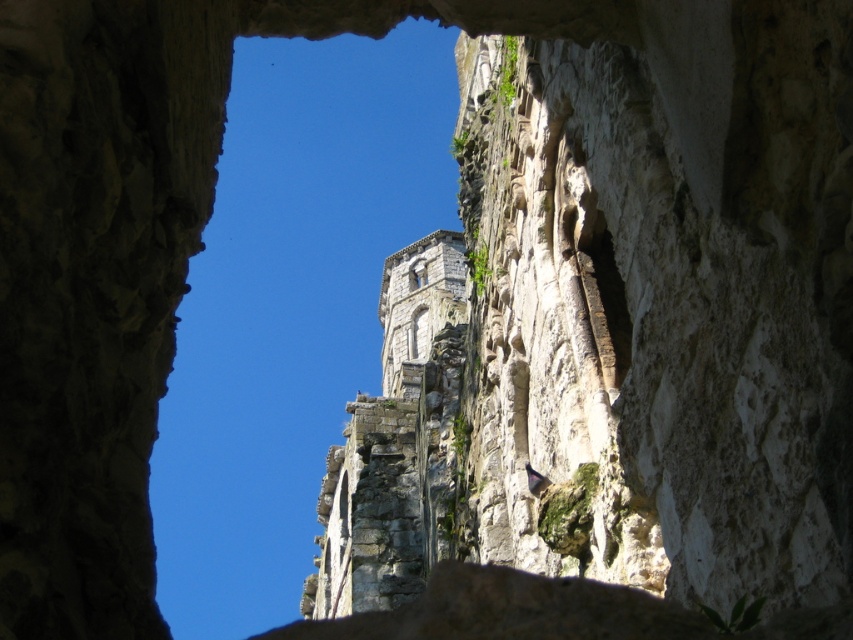
Question: Does stone archway at center appear on the right side of clear glass window at center?

Choices:
 (A) no
 (B) yes

Answer: (A)

Question: From the image, what is the correct spatial relationship of gray stone tower at center in relation to clear glass window at center?

Choices:
 (A) below
 (B) above

Answer: (A)

Question: Estimate the real-world distances between objects in this image. Which object is farther from the stone archway at center?

Choices:
 (A) clear glass window at center
 (B) gray stone tower at center

Answer: (A)

Question: Which of these objects is positioned closest to the gray stone tower at center?

Choices:
 (A) stone textured window at center
 (B) clear glass window at center

Answer: (A)

Question: Can you confirm if gray stone tower at center is positioned above stone textured window at center?

Choices:
 (A) no
 (B) yes

Answer: (B)

Question: Among these objects, which one is farthest from the camera?

Choices:
 (A) gray stone tower at center
 (B) stone archway at center
 (C) stone textured window at center

Answer: (C)